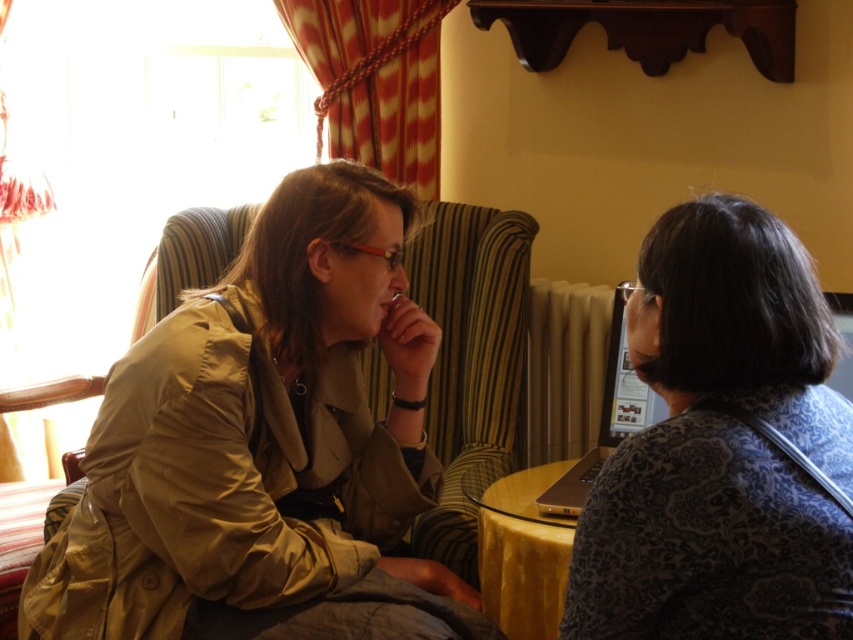
You are a tailor measuring fabrics for a project. You have a piece of fabric that is exactly the same width as the yellow glass table at center. Can the patterned fabric shirt at right be made from this fabric without needing to cut it? Explain your reasoning.

The patterned fabric shirt at right is wider than the yellow glass table at center. Since the fabric you have matches the table width, it is narrower than required for the shirt. Therefore, the shirt cannot be made from this fabric without cutting it to reduce the width.

You are a tailor measuring clothes for two customers. The first customer is wearing the matte khaki trench coat at left, and the second is wearing the patterned fabric shirt at right. Which customer requires a larger garment size?

The matte khaki trench coat at left has a larger size compared to the patterned fabric shirt at right, so the first customer requires a larger garment size.

You are a photographer setting up a shoot in this room. You need to position a light source to illuminate the matte khaki trench coat at left and the yellow glass table at center. Since the room has warm lighting, where should you place the light source relative to the objects to ensure both are well lit?

The matte khaki trench coat at left is located above the yellow glass table at center, so placing the light source above both objects would ensure even illumination for both the trench coat and the table.